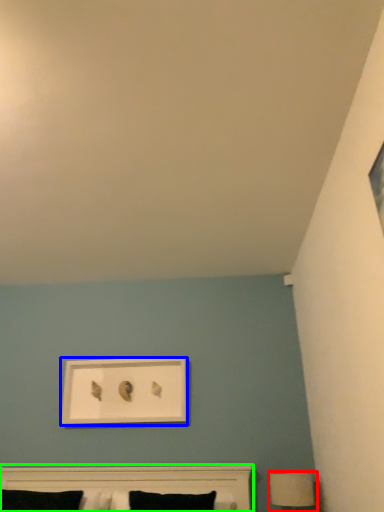
Question: Estimate the real-world distances between objects in this image. Which object is closer to table lamp (highlighted by a red box), picture frame (highlighted by a blue box) or bed (highlighted by a green box)?

Choices:
 (A) picture frame
 (B) bed

Answer: (B)